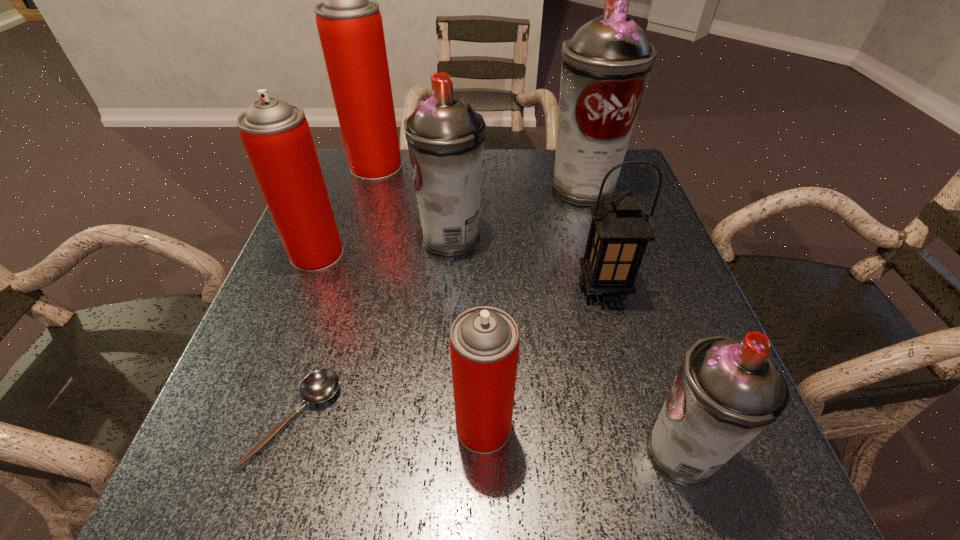
Identify the location of ladle that is at the left edge. (320, 385).

Find the location of a particular element. This screenshot has height=540, width=960. lantern that is at the right edge is located at coordinates (619, 233).

Find the location of a particular element. The height and width of the screenshot is (540, 960). object present at the far left corner is located at coordinates click(x=349, y=22).

This screenshot has width=960, height=540. I want to click on object that is positioned at the near left corner, so click(320, 385).

You are a GUI agent. You are given a task and a screenshot of the screen. Output one action in this format:
    pyautogui.click(x=<x>, y=<y>)
    Task: Click on the object present at the far right corner
    
    Given the screenshot: What is the action you would take?
    pyautogui.click(x=606, y=65)

Image resolution: width=960 pixels, height=540 pixels. What are the coordinates of `object located at the near right corner` in the screenshot? It's located at (727, 391).

At what (x,y) coordinates should I click in order to perform the action: click on free spot at the far edge of the desktop. Please return your answer as a coordinate pair (x, y). This screenshot has height=540, width=960. Looking at the image, I should click on (523, 189).

This screenshot has width=960, height=540. In the image, there is a desktop. Identify the location of vacant space at the near edge. (498, 483).

In the image, there is a desktop. Where is `free region at the left edge`? free region at the left edge is located at coordinates (295, 396).

Find the location of `vacant space at the right edge of the desktop`. vacant space at the right edge of the desktop is located at coordinates (665, 380).